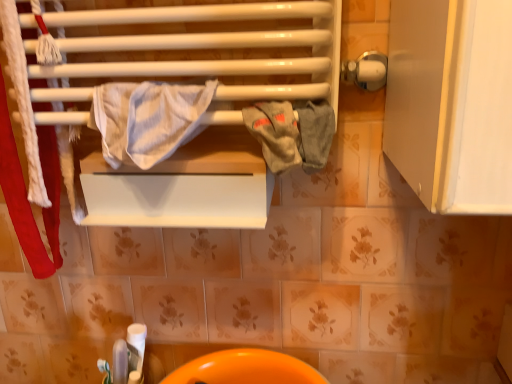
The image size is (512, 384). What do you see at coordinates (245, 369) in the screenshot?
I see `orange glossy sink at lower center` at bounding box center [245, 369].

What are the coordinates of `orange glossy sink at lower center` in the screenshot? It's located at coord(245,369).

Is gray cotton towel at center, the second bath towel when ordered from left to right, closer to camera compared to white striped fabric at center, which appears as the 2th bath towel when viewed from the right?

No, gray cotton towel at center, the second bath towel when ordered from left to right, is further to the viewer.

Is point (282, 152) closer or farther from the camera than point (141, 117)?

Point (282, 152) is closer to the camera than point (141, 117).

Considering the relative positions of gray cotton towel at center, which is the 1th bath towel from right to left, and white striped fabric at center, which appears as the 2th bath towel when viewed from the right, in the image provided, is gray cotton towel at center, which is the 1th bath towel from right to left, to the left or to the right of white striped fabric at center, which appears as the 2th bath towel when viewed from the right,?

gray cotton towel at center, which is the 1th bath towel from right to left, is to the right of white striped fabric at center, which appears as the 2th bath towel when viewed from the right.

Measure the distance between white striped fabric at center, which is the first bath towel from left to right, and orange glossy sink at lower center.

The distance of white striped fabric at center, which is the first bath towel from left to right, from orange glossy sink at lower center is 18.37 inches.

From the image's perspective, which is below, white striped fabric at center, which is the first bath towel from left to right, or orange glossy sink at lower center?

orange glossy sink at lower center is shown below in the image.

Is there a large distance between white striped fabric at center, which appears as the 2th bath towel when viewed from the right, and orange glossy sink at lower center?

They are positioned close to each other.

From a real-world perspective, is white striped fabric at center, which appears as the 2th bath towel when viewed from the right, positioned above or below orange glossy sink at lower center?

In terms of real-world spatial position, white striped fabric at center, which appears as the 2th bath towel when viewed from the right, is above orange glossy sink at lower center.

From a real-world perspective, is white striped fabric at center, which is the first bath towel from left to right, below gray cotton towel at center, which is the 1th bath towel from right to left?

No, from a real-world perspective, white striped fabric at center, which is the first bath towel from left to right, is not under gray cotton towel at center, which is the 1th bath towel from right to left.

Is point (195, 109) more distant than point (288, 169)?

That is False.

How different are the orientations of white striped fabric at center, which is the first bath towel from left to right, and gray cotton towel at center, which is the 1th bath towel from right to left, in degrees?

There is a 0.00212-degree angle between the facing directions of white striped fabric at center, which is the first bath towel from left to right, and gray cotton towel at center, which is the 1th bath towel from right to left.

Are white striped fabric at center, which is the first bath towel from left to right, and gray cotton towel at center, the second bath towel when ordered from left to right, located far from each other?

No.

Is white striped fabric at center, which is the first bath towel from left to right, at the back of orange glossy sink at lower center?

orange glossy sink at lower center does not have its back to white striped fabric at center, which is the first bath towel from left to right.

Is orange glossy sink at lower center bigger than white striped fabric at center, which is the first bath towel from left to right?

Indeed, orange glossy sink at lower center has a larger size compared to white striped fabric at center, which is the first bath towel from left to right.

Between orange glossy sink at lower center and white striped fabric at center, which appears as the 2th bath towel when viewed from the right, which one has less height?

orange glossy sink at lower center is shorter.

Is orange glossy sink at lower center positioned behind white striped fabric at center, which appears as the 2th bath towel when viewed from the right?

Yes, it is behind white striped fabric at center, which appears as the 2th bath towel when viewed from the right.

Could you tell me if gray cotton towel at center, the second bath towel when ordered from left to right, is turned towards orange glossy sink at lower center?

No, gray cotton towel at center, the second bath towel when ordered from left to right, does not turn towards orange glossy sink at lower center.

Is the position of gray cotton towel at center, which is the 1th bath towel from right to left, less distant than that of orange glossy sink at lower center?

Yes, it is.

The height and width of the screenshot is (384, 512). I want to click on sink below the gray cotton towel at center, which is the 1th bath towel from right to left (from the image's perspective), so click(x=245, y=369).

Is point (292, 113) positioned behind point (234, 369)?

No.

Based on the photo, who is more distant, orange glossy sink at lower center or gray cotton towel at center, the second bath towel when ordered from left to right?

Positioned behind is orange glossy sink at lower center.

In the scene shown: Can you confirm if orange glossy sink at lower center is smaller than gray cotton towel at center, which is the 1th bath towel from right to left?

No, orange glossy sink at lower center is not smaller than gray cotton towel at center, which is the 1th bath towel from right to left.

Looking at this image, from the image's perspective, which is below, orange glossy sink at lower center or gray cotton towel at center, the second bath towel when ordered from left to right?

orange glossy sink at lower center appears lower in the image.

This screenshot has height=384, width=512. In order to click on bath towel in front of the gray cotton towel at center, which is the 1th bath towel from right to left in this screenshot , I will do `click(148, 119)`.

This screenshot has width=512, height=384. What are the coordinates of `sink that appears behind the white striped fabric at center, which is the first bath towel from left to right` in the screenshot? It's located at pyautogui.click(x=245, y=369).

Which object lies nearer to the anchor point white striped fabric at center, which is the first bath towel from left to right, orange glossy sink at lower center or gray cotton towel at center, which is the 1th bath towel from right to left?

gray cotton towel at center, which is the 1th bath towel from right to left, lies closer to white striped fabric at center, which is the first bath towel from left to right, than the other object.

Which object lies further to the anchor point gray cotton towel at center, which is the 1th bath towel from right to left, white striped fabric at center, which appears as the 2th bath towel when viewed from the right, or orange glossy sink at lower center?

The object further to gray cotton towel at center, which is the 1th bath towel from right to left, is orange glossy sink at lower center.

Consider the image. From the image, which object appears to be nearer to orange glossy sink at lower center, white striped fabric at center, which is the first bath towel from left to right, or gray cotton towel at center, which is the 1th bath towel from right to left?

gray cotton towel at center, which is the 1th bath towel from right to left, is positioned closer to the anchor orange glossy sink at lower center.

Considering their positions, is gray cotton towel at center, the second bath towel when ordered from left to right, positioned closer to white striped fabric at center, which appears as the 2th bath towel when viewed from the right, than orange glossy sink at lower center?

The object closer to white striped fabric at center, which appears as the 2th bath towel when viewed from the right, is gray cotton towel at center, the second bath towel when ordered from left to right.

Looking at the image, which one is located further to gray cotton towel at center, the second bath towel when ordered from left to right, orange glossy sink at lower center or white striped fabric at center, which is the first bath towel from left to right?

The object further to gray cotton towel at center, the second bath towel when ordered from left to right, is orange glossy sink at lower center.

From the image, which object appears to be nearer to orange glossy sink at lower center, gray cotton towel at center, which is the 1th bath towel from right to left, or white striped fabric at center, which appears as the 2th bath towel when viewed from the right?

Based on the image, gray cotton towel at center, which is the 1th bath towel from right to left, appears to be nearer to orange glossy sink at lower center.

Where is `bath towel between white striped fabric at center, which appears as the 2th bath towel when viewed from the right, and orange glossy sink at lower center from top to bottom`? bath towel between white striped fabric at center, which appears as the 2th bath towel when viewed from the right, and orange glossy sink at lower center from top to bottom is located at coordinates (275, 133).